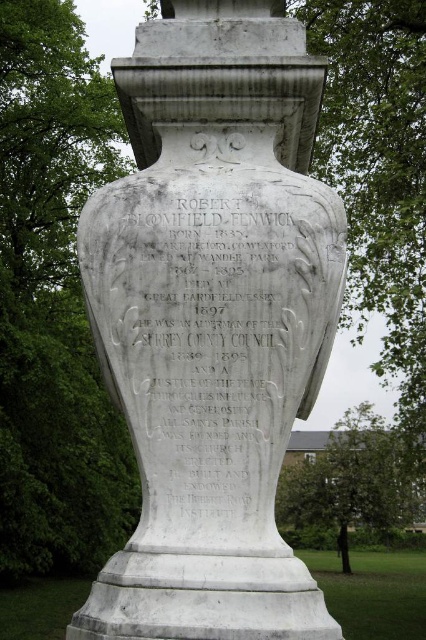
Which is more to the right, white marble vase at center or green leafy tree at center?

green leafy tree at center

Between white marble vase at center and green leafy tree at center, which one is positioned lower?

green leafy tree at center

Identify the location of white marble vase at center. (213, 320).

Identify the location of white marble vase at center. This screenshot has height=640, width=426. (213, 320).

Can you confirm if white marble vase at center is taller than white marble text at center?

Indeed, white marble vase at center has a greater height compared to white marble text at center.

Is white marble vase at center bigger than white marble text at center?

Correct, white marble vase at center is larger in size than white marble text at center.

Who is more distant from viewer, (187, 353) or (178, 259)?

The point (178, 259) is behind.

The height and width of the screenshot is (640, 426). Find the location of `white marble vase at center`. white marble vase at center is located at coordinates (213, 320).

In the scene shown: Is white marble text at center below green leafy tree at center?

No.

Can you confirm if white marble text at center is taller than green leafy tree at center?

Yes.

Locate an element on the screen. The image size is (426, 640). white marble text at center is located at coordinates (213, 349).

This screenshot has width=426, height=640. I want to click on white marble text at center, so click(x=213, y=349).